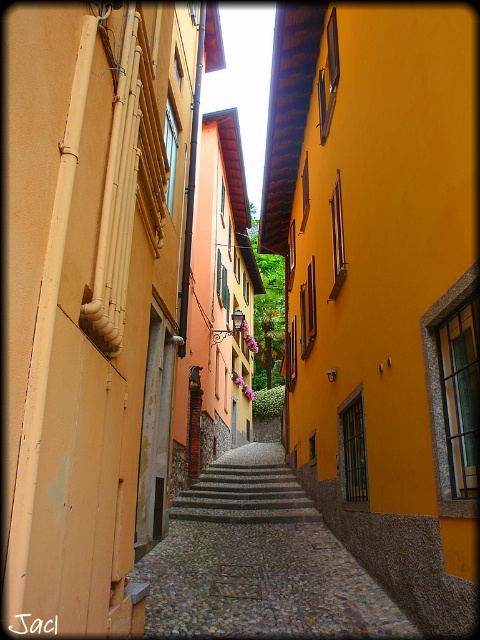
Does cobblestone path at center have a greater width compared to gray stone stairs at center?

Correct, the width of cobblestone path at center exceeds that of gray stone stairs at center.

Who is more distant from viewer, (x=251, y=516) or (x=245, y=513)?

Point (x=245, y=513)

Find the location of `cobblestone path at center`. cobblestone path at center is located at coordinates (257, 561).